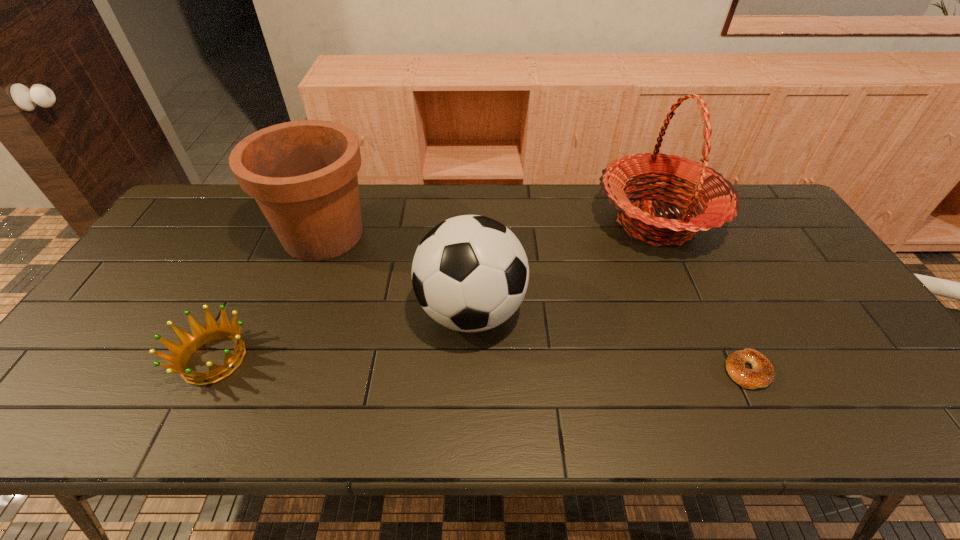
Identify the location of free space between the bagel and the tallest object. (702, 296).

At what (x,y) coordinates should I click in order to perform the action: click on free space between the flowerpot and the crown. Please return your answer as a coordinate pair (x, y). Looking at the image, I should click on (269, 297).

At what (x,y) coordinates should I click in order to perform the action: click on vacant region between the tallest object and the soccer ball. Please return your answer as a coordinate pair (x, y). The height and width of the screenshot is (540, 960). Looking at the image, I should click on (564, 267).

This screenshot has height=540, width=960. I want to click on object that is the fourth closest one to the soccer ball, so click(x=762, y=374).

Locate which object is the second closest to the flowerpot. Please provide its 2D coordinates. Your answer should be formatted as a tuple, i.e. [(x, y)], where the tuple contains the x and y coordinates of a point satisfying the conditions above.

[(190, 343)]

Where is `free location that satisfies the following two spatial constraints: 1. on the back side of the flowerpot; 2. on the right side of the basket`? free location that satisfies the following two spatial constraints: 1. on the back side of the flowerpot; 2. on the right side of the basket is located at coordinates [x=328, y=222].

Find the location of a particular element. This screenshot has width=960, height=540. free space that satisfies the following two spatial constraints: 1. on the front side of the flowerpot; 2. on the right side of the third object from left to right is located at coordinates (295, 311).

Where is `free space that satisfies the following two spatial constraints: 1. on the front side of the soccer ball; 2. on the left side of the bagel`? The height and width of the screenshot is (540, 960). free space that satisfies the following two spatial constraints: 1. on the front side of the soccer ball; 2. on the left side of the bagel is located at coordinates (470, 370).

This screenshot has width=960, height=540. I want to click on vacant space that satisfies the following two spatial constraints: 1. on the back side of the flowerpot; 2. on the left side of the basket, so click(328, 222).